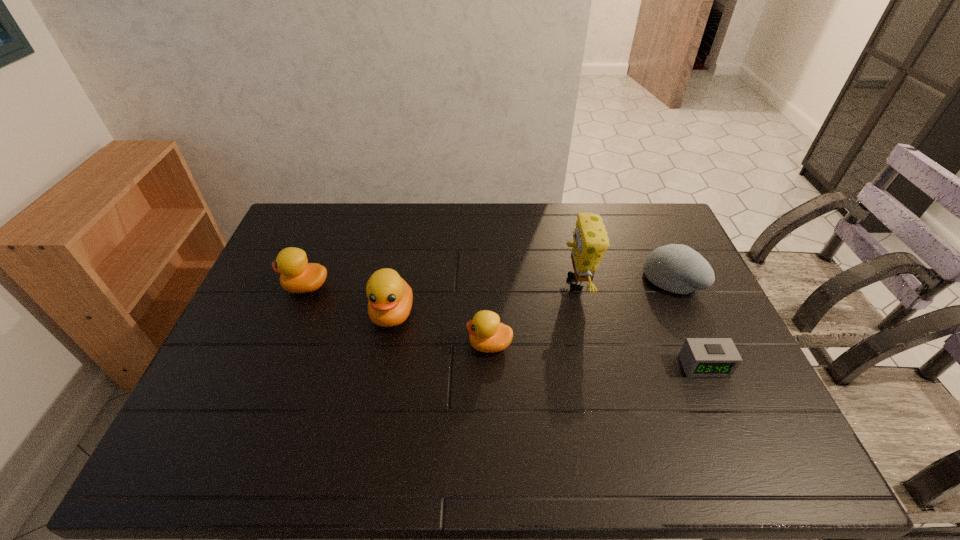
The height and width of the screenshot is (540, 960). What are the coordinates of `vacant point located 0.250m on the face of the third object from left to right` in the screenshot? It's located at (375, 345).

The width and height of the screenshot is (960, 540). What are the coordinates of `blank area located on the face of the third object from left to right` in the screenshot? It's located at (339, 345).

Identify the location of vacant space located on the face of the third object from left to right. (426, 345).

I want to click on free location located on the front-facing side of the shortest object, so click(720, 401).

Identify the location of vacant space located 0.230m on the face of the tallest object. Image resolution: width=960 pixels, height=540 pixels. (487, 282).

What are the coordinates of `vacant region located 0.390m on the face of the tallest object` in the screenshot? It's located at (436, 282).

Where is `vacant space situated on the face of the tallest object`? The image size is (960, 540). vacant space situated on the face of the tallest object is located at coordinates (524, 282).

Find the location of `vacant area situated on the front of the beanie`. vacant area situated on the front of the beanie is located at coordinates (713, 374).

In order to click on object at the left edge in this screenshot , I will do `click(297, 275)`.

The height and width of the screenshot is (540, 960). I want to click on alarm clock present at the right edge, so click(x=700, y=357).